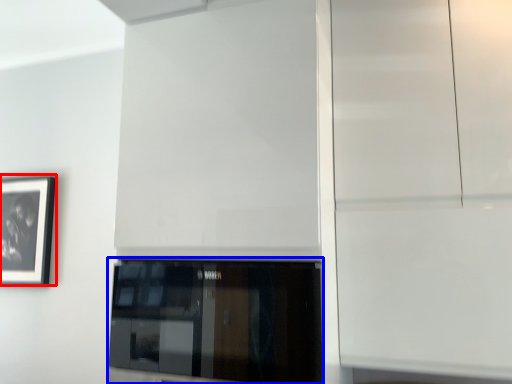
Question: Which point is further to the camera, picture frame (highlighted by a red box) or window (highlighted by a blue box)?

Choices:
 (A) picture frame
 (B) window

Answer: (A)